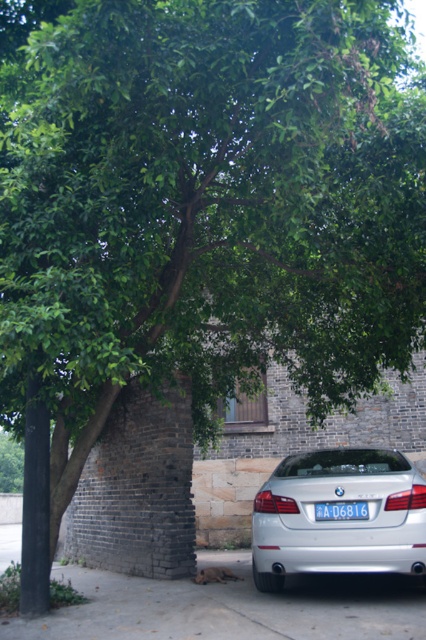
You are standing at the point marked as point (x=230, y=608). Which object is directly under your feet?

The gray concrete pavement at lower center is located at point (x=230, y=608), so the object directly under your feet is the gray concrete pavement at lower center.